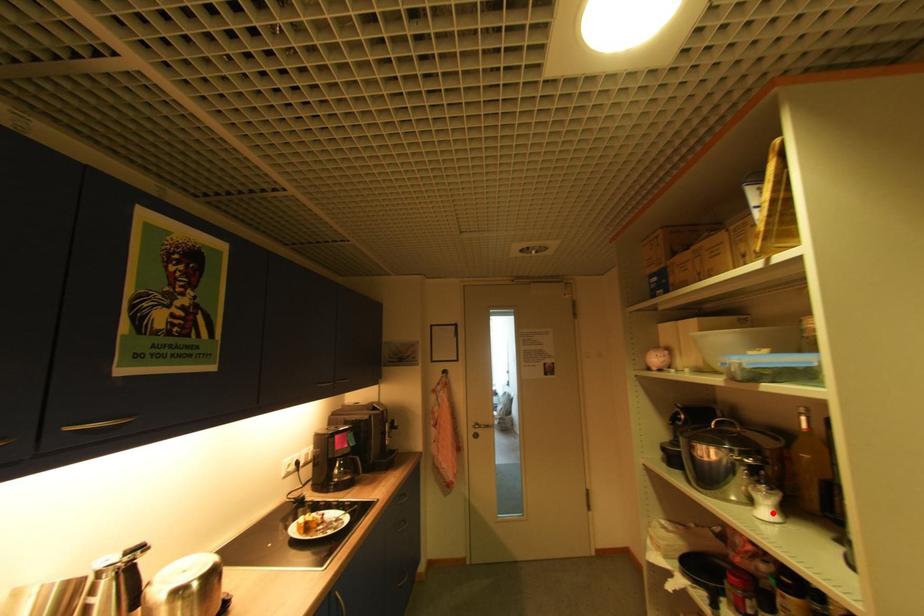
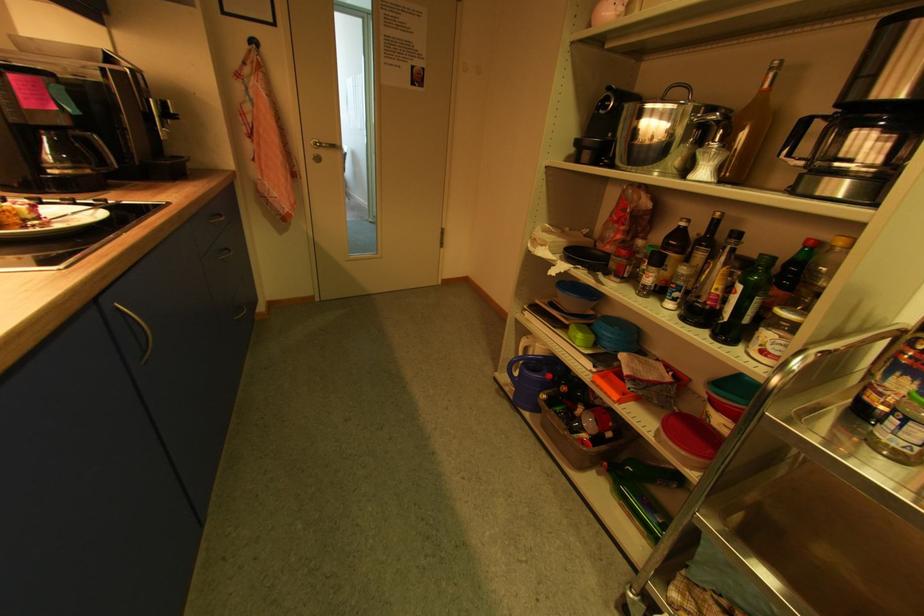
The point at the highlighted location is marked in the first image. Where is the corresponding point in the second image?

(709, 175)